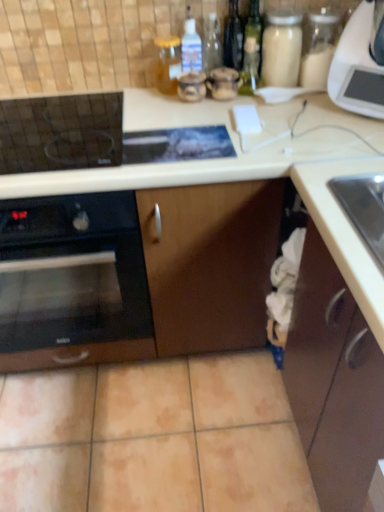
Question: Is black glass oven at left outside of translucent glass jar at upper center?

Choices:
 (A) no
 (B) yes

Answer: (B)

Question: Can you confirm if black glass oven at left is wider than translucent glass jar at upper center?

Choices:
 (A) no
 (B) yes

Answer: (B)

Question: Is black glass oven at left behind translucent glass jar at upper center?

Choices:
 (A) yes
 (B) no

Answer: (B)

Question: From the image's perspective, is black glass oven at left beneath translucent glass jar at upper center?

Choices:
 (A) no
 (B) yes

Answer: (B)

Question: From the image's perspective, is black glass oven at left above translucent glass jar at upper center?

Choices:
 (A) yes
 (B) no

Answer: (B)

Question: Looking at the image, does brown matte cabinet at lower right seem bigger or smaller compared to translucent glass jar at upper center?

Choices:
 (A) big
 (B) small

Answer: (A)

Question: Is point (x=312, y=291) positioned closer to the camera than point (x=180, y=48)?

Choices:
 (A) farther
 (B) closer

Answer: (B)

Question: Considering the positions of brown matte cabinet at lower right and translucent glass jar at upper center in the image, is brown matte cabinet at lower right taller or shorter than translucent glass jar at upper center?

Choices:
 (A) tall
 (B) short

Answer: (A)

Question: From a real-world perspective, is brown matte cabinet at lower right positioned above or below translucent glass jar at upper center?

Choices:
 (A) below
 (B) above

Answer: (A)

Question: From the image's perspective, is white plastic microwave at upper right positioned above or below brown matte cabinet at lower right?

Choices:
 (A) below
 (B) above

Answer: (B)

Question: Is white plastic microwave at upper right taller or shorter than brown matte cabinet at lower right?

Choices:
 (A) tall
 (B) short

Answer: (B)

Question: Is white plastic microwave at upper right wider or thinner than brown matte cabinet at lower right?

Choices:
 (A) thin
 (B) wide

Answer: (A)

Question: From a real-world perspective, is white plastic microwave at upper right physically located above or below brown matte cabinet at lower right?

Choices:
 (A) below
 (B) above

Answer: (B)

Question: Looking at their shapes, would you say black glass oven at left is wider or thinner than brown matte cabinet at lower right?

Choices:
 (A) thin
 (B) wide

Answer: (B)

Question: Does point (127, 289) appear closer or farther from the camera than point (327, 291)?

Choices:
 (A) farther
 (B) closer

Answer: (A)